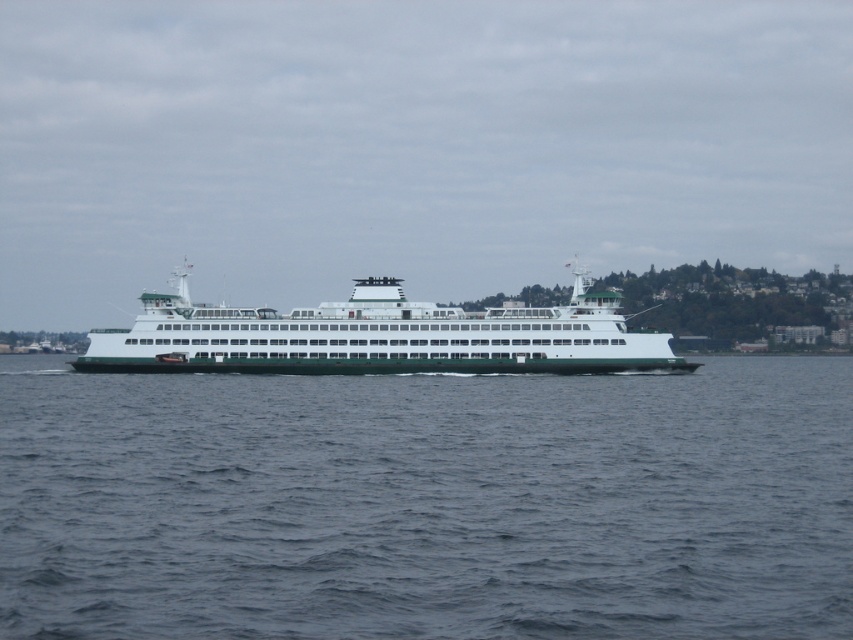
Question: Does blue water at center lie behind green matte ferry at center?

Choices:
 (A) no
 (B) yes

Answer: (A)

Question: Where is blue water at center located in relation to green matte ferry at center in the image?

Choices:
 (A) below
 (B) above

Answer: (A)

Question: Which point is closer to the camera taking this photo?

Choices:
 (A) pos(573,362)
 (B) pos(746,621)

Answer: (B)

Question: Is blue water at center above green matte ferry at center?

Choices:
 (A) yes
 (B) no

Answer: (B)

Question: Among these objects, which one is farthest from the camera?

Choices:
 (A) blue water at center
 (B) green matte ferry at center

Answer: (B)